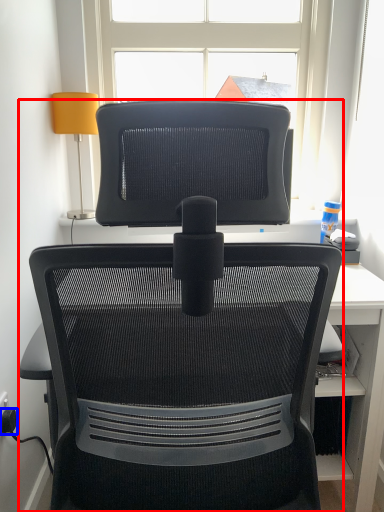
Question: Which of the following is the farthest to the observer, chair (highlighted by a red box) or plug (highlighted by a blue box)?

Choices:
 (A) chair
 (B) plug

Answer: (B)